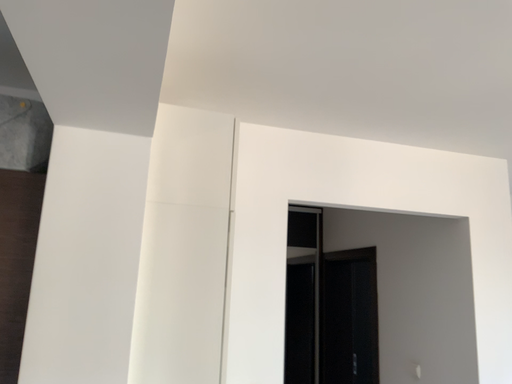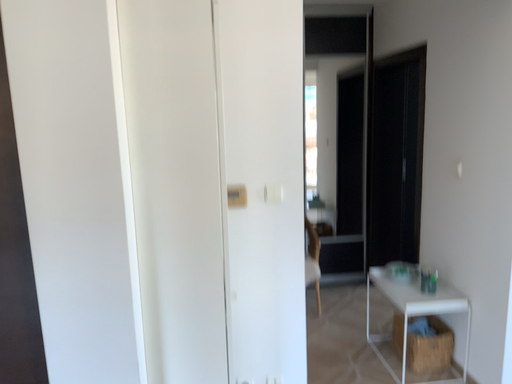
Question: Which way did the camera rotate in the video?

Choices:
 (A) rotated right
 (B) rotated left

Answer: (B)